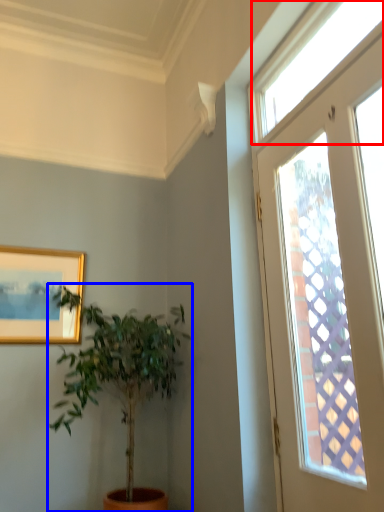
Question: Which of the following is the closest to the observer, window (highlighted by a red box) or houseplant (highlighted by a blue box)?

Choices:
 (A) window
 (B) houseplant

Answer: (A)